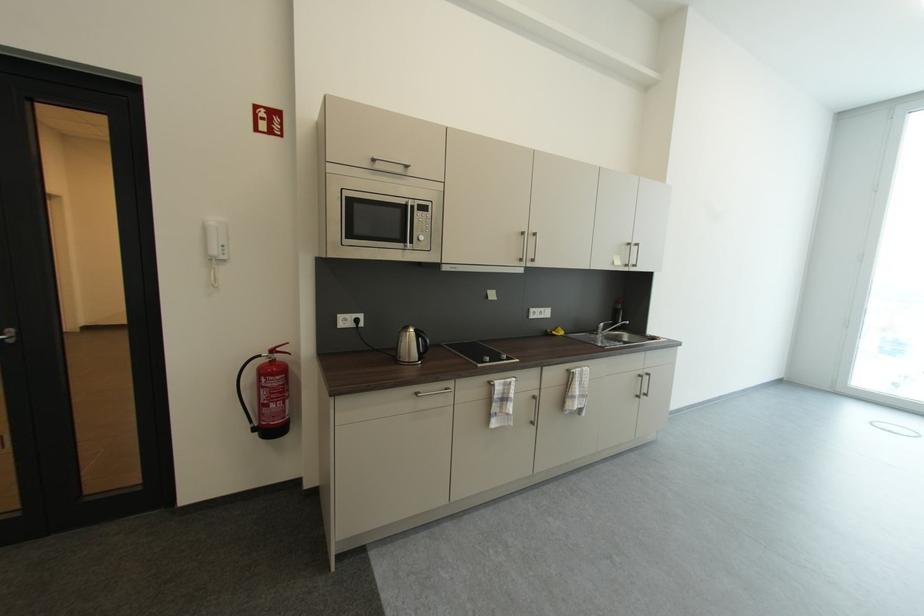
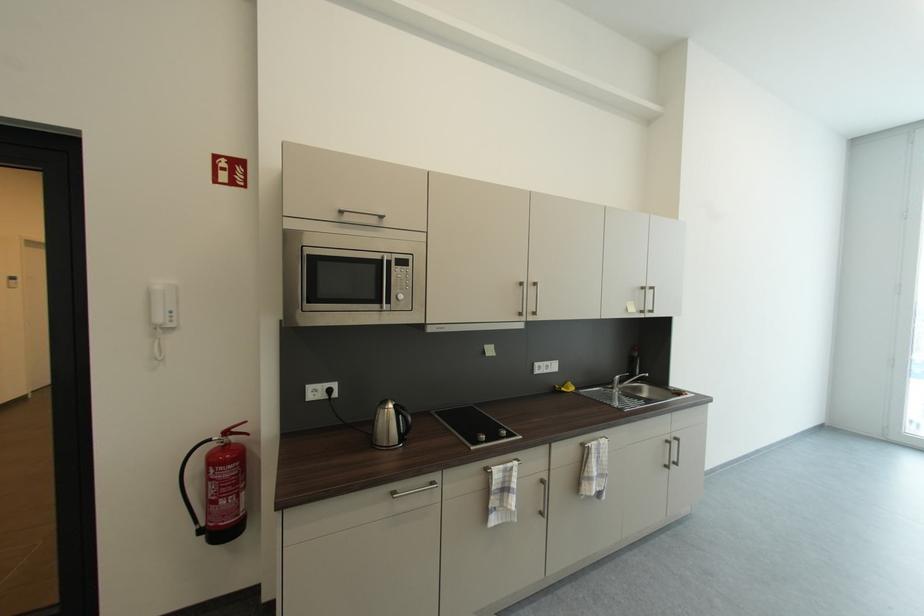
In the second image, find the point that corresponds to (x=561, y=334) in the first image.

(569, 391)